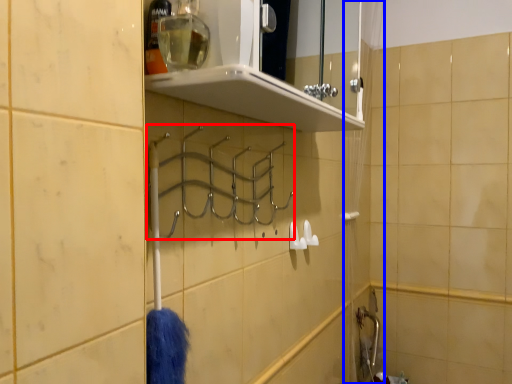
Question: Which object appears farthest to the camera in this image, hanger (highlighted by a red box) or shower curtain (highlighted by a blue box)?

Choices:
 (A) hanger
 (B) shower curtain

Answer: (B)